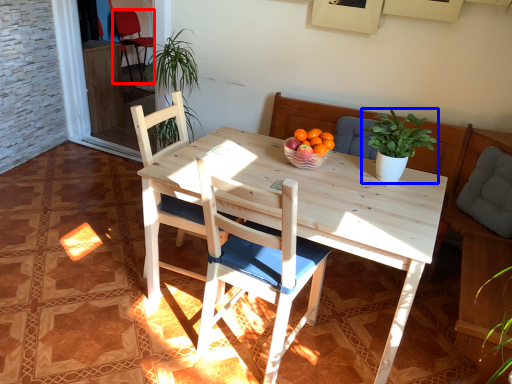
Question: Which of the following is the farthest to the observer, chair (highlighted by a red box) or houseplant (highlighted by a blue box)?

Choices:
 (A) chair
 (B) houseplant

Answer: (A)